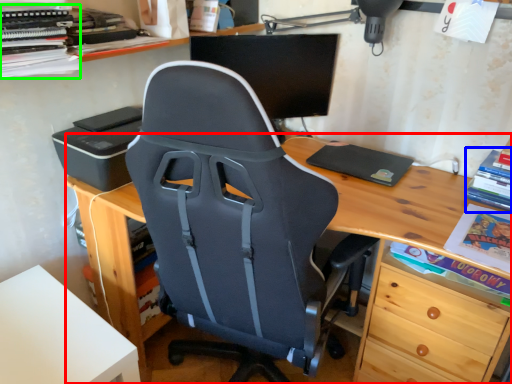
Question: Which is farther away from desk (highlighted by a red box)? book (highlighted by a blue box) or book (highlighted by a green box)?

Choices:
 (A) book
 (B) book

Answer: (B)